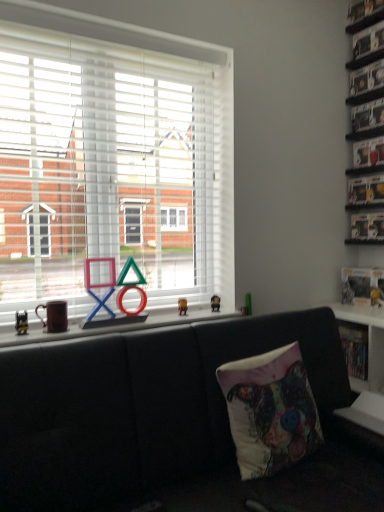
Question: From the image's perspective, is metallic silver shelf at upper right, acting as the 2th shelf starting from the top, beneath clear plastic shelf at upper right, marked as the 1th shelf in a top-to-bottom arrangement?

Choices:
 (A) yes
 (B) no

Answer: (A)

Question: Are metallic silver shelf at upper right, the 4th shelf positioned from the bottom, and clear plastic shelf at upper right, acting as the 5th shelf starting from the bottom, located far from each other?

Choices:
 (A) yes
 (B) no

Answer: (B)

Question: From a real-world perspective, is metallic silver shelf at upper right, the 4th shelf positioned from the bottom, over clear plastic shelf at upper right, acting as the 5th shelf starting from the bottom?

Choices:
 (A) no
 (B) yes

Answer: (A)

Question: From the image's perspective, is metallic silver shelf at upper right, the 4th shelf positioned from the bottom, located above clear plastic shelf at upper right, marked as the 1th shelf in a top-to-bottom arrangement?

Choices:
 (A) yes
 (B) no

Answer: (B)

Question: Is the surface of metallic silver shelf at upper right, the 4th shelf positioned from the bottom, in direct contact with clear plastic shelf at upper right, acting as the 5th shelf starting from the bottom?

Choices:
 (A) no
 (B) yes

Answer: (A)

Question: Is metallic silver shelf at upper right, acting as the 2th shelf starting from the top, completely or partially outside of clear plastic shelf at upper right, acting as the 5th shelf starting from the bottom?

Choices:
 (A) no
 (B) yes

Answer: (B)

Question: From a real-world perspective, is white plastic shelf at lower right, which is counted as the 5th shelf, starting from the top, located higher than white plastic window at center?

Choices:
 (A) yes
 (B) no

Answer: (B)

Question: Can you confirm if white plastic shelf at lower right, which is the first shelf from bottom to top, is bigger than white plastic window at center?

Choices:
 (A) no
 (B) yes

Answer: (A)

Question: Is white plastic shelf at lower right, which is the first shelf from bottom to top, shorter than white plastic window at center?

Choices:
 (A) yes
 (B) no

Answer: (A)

Question: Can you confirm if white plastic shelf at lower right, which is the first shelf from bottom to top, is taller than white plastic window at center?

Choices:
 (A) yes
 (B) no

Answer: (B)

Question: Is white plastic shelf at lower right, which is counted as the 5th shelf, starting from the top, located outside white plastic window at center?

Choices:
 (A) no
 (B) yes

Answer: (B)

Question: Is white plastic shelf at lower right, which is counted as the 5th shelf, starting from the top, at the right side of white plastic window at center?

Choices:
 (A) no
 (B) yes

Answer: (B)

Question: From a real-world perspective, is metallic silver shelf at upper right, acting as the 2th shelf starting from the top, beneath metallic silver shelf at upper right, the 3th shelf in the top-to-bottom sequence?

Choices:
 (A) yes
 (B) no

Answer: (B)